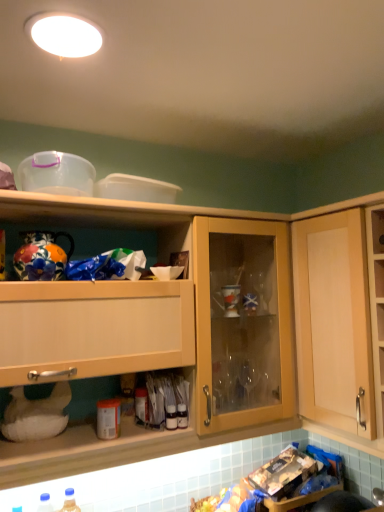
Question: Looking at the image, does matte plastic bottle at center, which is the 2th bottle from right to left, seem bigger or smaller compared to white glossy light fixture at upper center?

Choices:
 (A) big
 (B) small

Answer: (B)

Question: Do you think matte plastic bottle at center, positioned as the 3th bottle in bottom-to-top order, is within white glossy light fixture at upper center, or outside of it?

Choices:
 (A) inside
 (B) outside

Answer: (B)

Question: Which is farther from the translucent plastic bottle at center, arranged as the 3th bottle when viewed from the left?

Choices:
 (A) blue plastic bottle at lower left, the 1th bottle from the bottom
 (B) wooden cabinet at upper center, which appears as the second cabinetry when viewed from the right
 (C) light wood cabinet at right, the second cabinetry positioned from the left
 (D) white glossy light fixture at upper center
 (E) matte plastic bottle at center, which is the 2th bottle from right to left

Answer: (D)

Question: Estimate the real-world distances between objects in this image. Which object is closer to the light wood cabinet at right, marked as the first cabinetry in a right-to-left arrangement?

Choices:
 (A) white glossy light fixture at upper center
 (B) wooden cabinet at upper center, which appears as the second cabinetry when viewed from the right
 (C) matte plastic bottle at center, acting as the 2th bottle starting from the left
 (D) blue plastic bottle at lower left, which ranks as the third bottle in right-to-left order
 (E) translucent plastic bottle at center, which is the second bottle from top to bottom

Answer: (B)